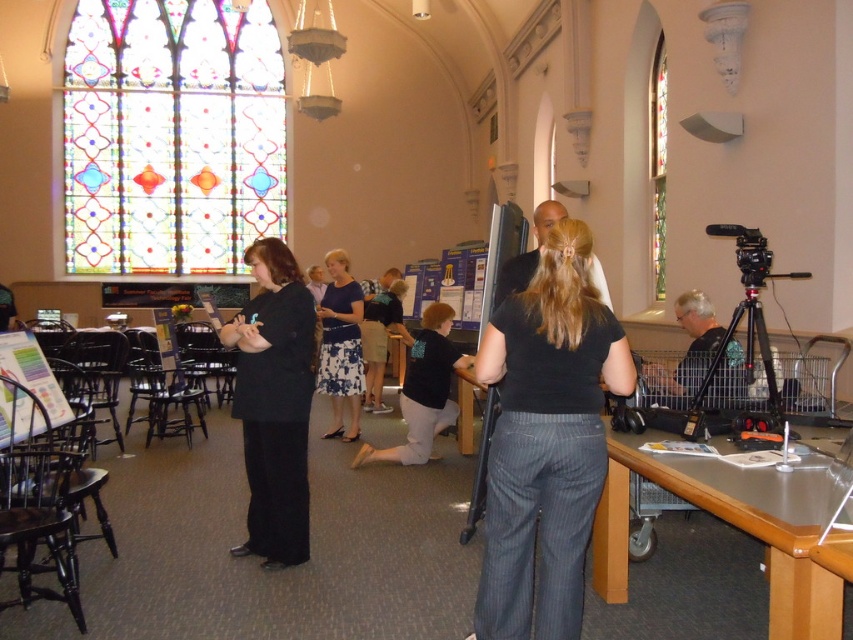
Does metallic gray table at lower right have a greater width compared to blue floral dress at center?

Indeed, metallic gray table at lower right has a greater width compared to blue floral dress at center.

Can you confirm if metallic gray table at lower right is shorter than blue floral dress at center?

Correct, metallic gray table at lower right is not as tall as blue floral dress at center.

What do you see at coordinates (730, 524) in the screenshot?
I see `metallic gray table at lower right` at bounding box center [730, 524].

This screenshot has width=853, height=640. What are the coordinates of `metallic gray table at lower right` in the screenshot? It's located at (730, 524).

Can you confirm if black matte/black pants at center is positioned to the right of blue floral dress at center?

Incorrect, black matte/black pants at center is not on the right side of blue floral dress at center.

Is point (263, 467) less distant than point (341, 268)?

Yes.

What are the coordinates of `black matte/black pants at center` in the screenshot? It's located at (274, 403).

Can you confirm if stained glass window at upper left is smaller than blue floral dress at center?

No, stained glass window at upper left is not smaller than blue floral dress at center.

Between point (78, 184) and point (334, 397), which one is positioned behind?

Point (78, 184)

Where is `stained glass window at upper left`? stained glass window at upper left is located at coordinates (171, 134).

Where is `stained glass window at upper left`? stained glass window at upper left is located at coordinates (171, 134).